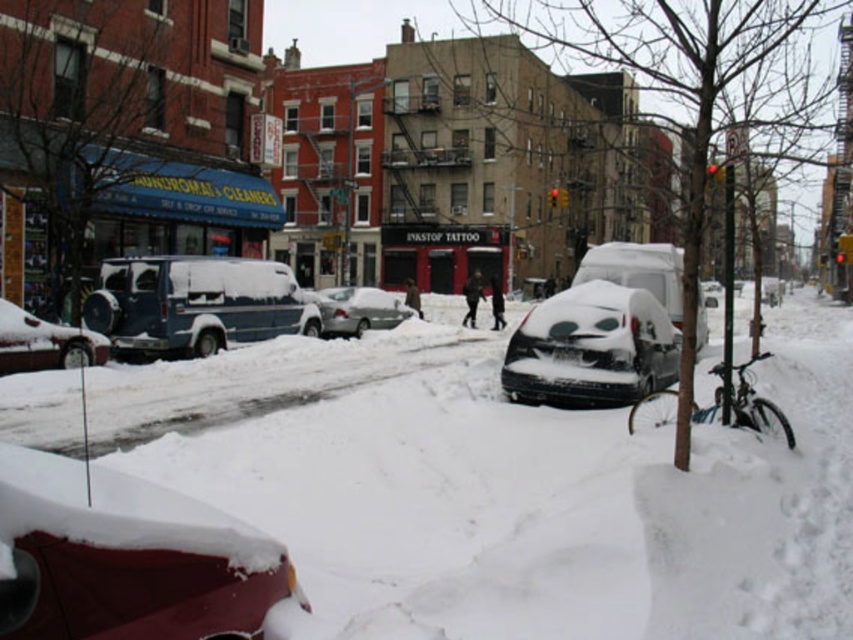
Question: Is the position of shiny red car at lower left more distant than that of snow-covered car at center?

Choices:
 (A) no
 (B) yes

Answer: (A)

Question: Is sleek white van at center smaller than silver metallic sedan at center?

Choices:
 (A) yes
 (B) no

Answer: (B)

Question: Among these points, which one is farthest from the camera?

Choices:
 (A) (148, 570)
 (B) (408, 506)

Answer: (B)

Question: Which point is farther to the camera?

Choices:
 (A) (653, 243)
 (B) (207, 625)
 (C) (407, 310)
 (D) (506, 429)

Answer: (A)

Question: Where is sleek white van at center located in relation to matte black suv at left in the image?

Choices:
 (A) left
 (B) right

Answer: (B)

Question: Which is farther from the silver metallic sedan at center?

Choices:
 (A) shiny red car at lower left
 (B) snow-covered car at center

Answer: (A)